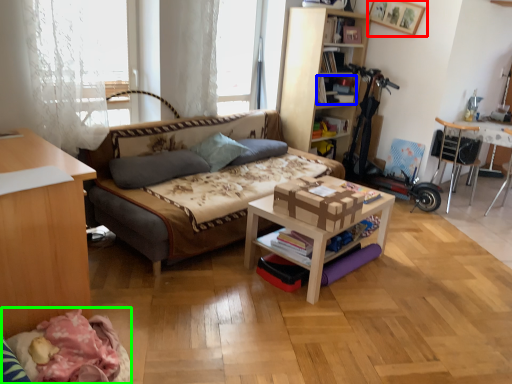
Question: Which is nearer to the picture frame (highlighted by a red box)? book (highlighted by a blue box) or day bed (highlighted by a green box).

Choices:
 (A) book
 (B) day bed

Answer: (A)